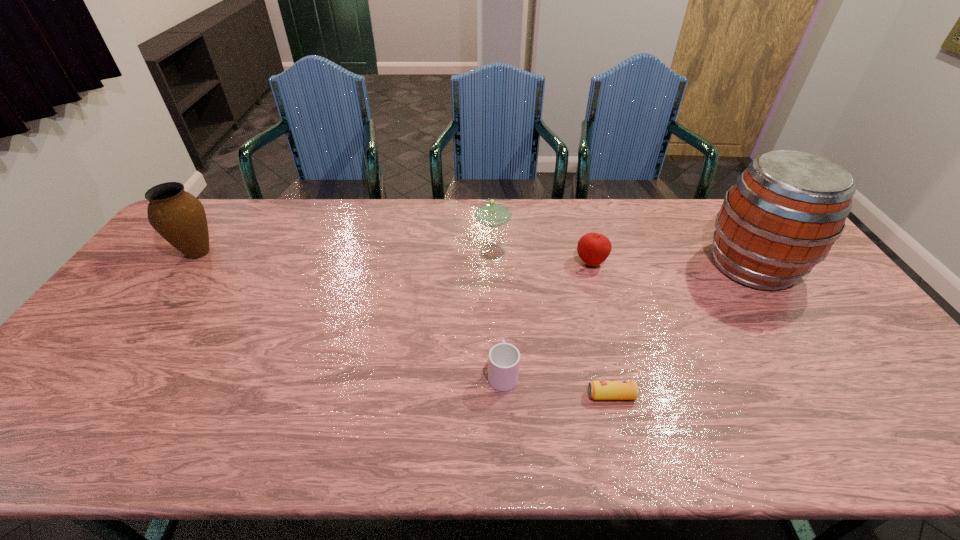
The image size is (960, 540). I want to click on vacant region between the tallest object and the leftmost object, so click(475, 259).

Identify the location of unoccupied position between the leftmost object and the cup. (350, 313).

You are a GUI agent. You are given a task and a screenshot of the screen. Output one action in this format:
    pyautogui.click(x=<x>, y=<y>)
    Task: Click on the free space between the rightmost object and the apple
    
    Given the screenshot: What is the action you would take?
    pyautogui.click(x=672, y=264)

Where is `vacant area between the beer can and the cup`? This screenshot has height=540, width=960. vacant area between the beer can and the cup is located at coordinates (557, 384).

Image resolution: width=960 pixels, height=540 pixels. I want to click on vacant region between the third tallest object and the apple, so click(543, 258).

Image resolution: width=960 pixels, height=540 pixels. Find the location of `free space between the apple and the fourth shortest object`. free space between the apple and the fourth shortest object is located at coordinates (543, 258).

Locate an element on the screen. The width and height of the screenshot is (960, 540). vacant space in between the shortest object and the tallest object is located at coordinates (682, 330).

Find the location of a particular element. This screenshot has height=540, width=960. object that stands as the fourth closest to the beer can is located at coordinates (493, 213).

Select which object is the closest to the fourth shortest object. Please provide its 2D coordinates. Your answer should be formatted as a tuple, i.e. [(x, y)], where the tuple contains the x and y coordinates of a point satisfying the conditions above.

[(593, 248)]

Where is `vacant space that satisfies the following two spatial constraints: 1. on the front side of the apple; 2. on the right side of the leftmost object`? The width and height of the screenshot is (960, 540). vacant space that satisfies the following two spatial constraints: 1. on the front side of the apple; 2. on the right side of the leftmost object is located at coordinates (191, 262).